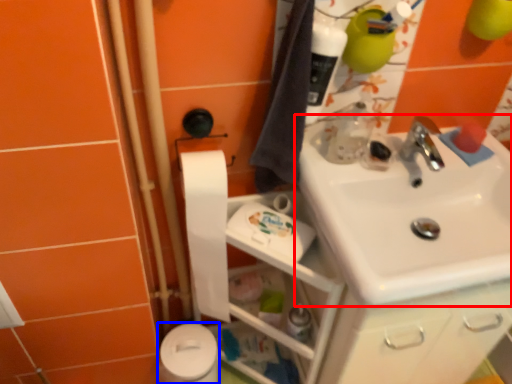
Question: Among these objects, which one is farthest to the camera, sink (highlighted by a red box) or toilet paper (highlighted by a blue box)?

Choices:
 (A) sink
 (B) toilet paper

Answer: (B)